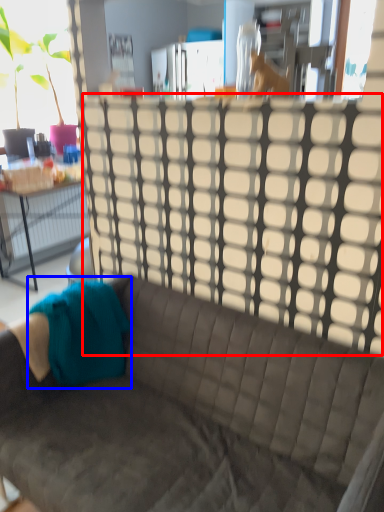
Question: Which object is closer to the camera taking this photo, glass door (highlighted by a red box) or fabric (highlighted by a blue box)?

Choices:
 (A) glass door
 (B) fabric

Answer: (A)